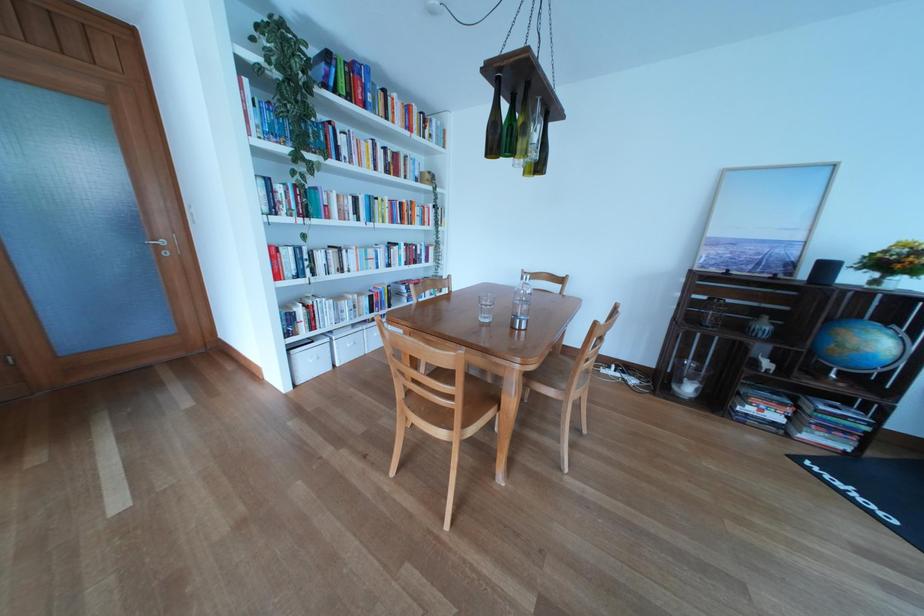
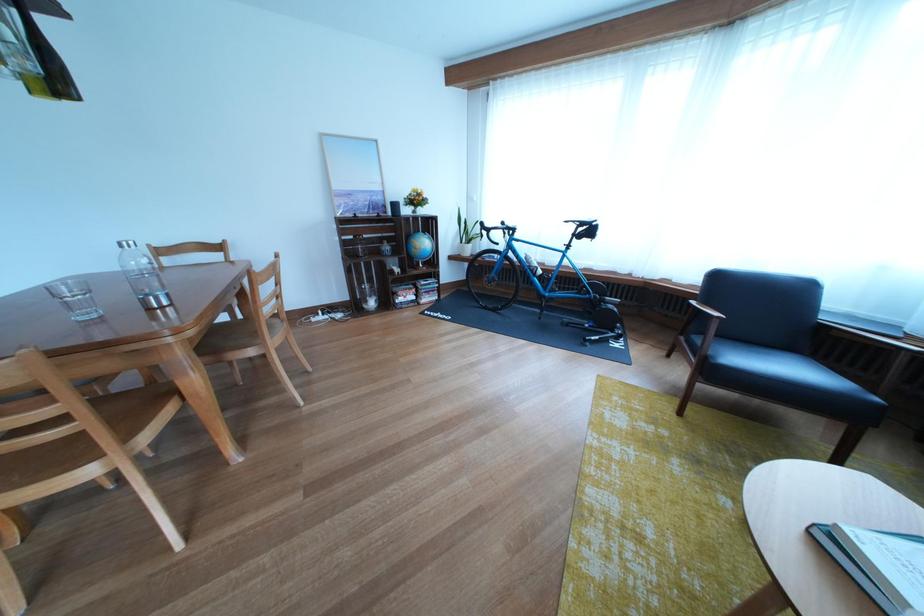
The images are taken continuously from a first-person perspective. In which direction is your viewpoint rotating?

The rotation direction of the camera is right-down.